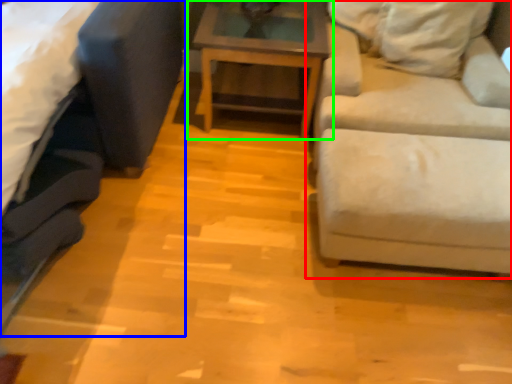
Question: Which object is positioned farthest from studio couch (highlighted by a red box)? Select from studio couch (highlighted by a blue box) and table (highlighted by a green box).

Choices:
 (A) studio couch
 (B) table

Answer: (A)